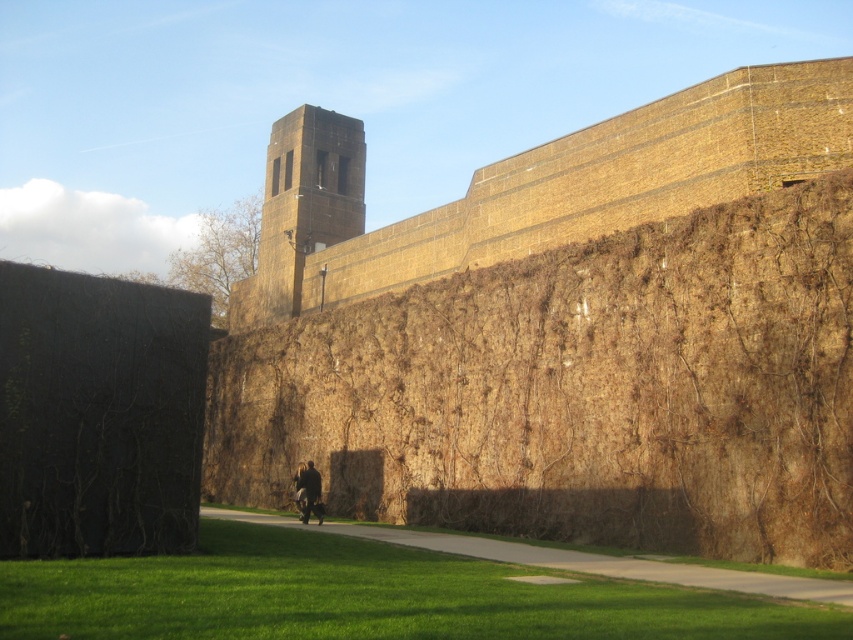
Is green grass at lower center further to the viewer compared to dark brown leather jacket at center?

No, green grass at lower center is closer to the viewer.

Is green grass at lower center thinner than dark brown leather jacket at center?

In fact, green grass at lower center might be wider than dark brown leather jacket at center.

Identify the location of green grass at lower center. (364, 596).

Can you confirm if brown textured hedge at center is positioned to the left of black textured hedge at left?

No, brown textured hedge at center is not to the left of black textured hedge at left.

Can you confirm if brown textured hedge at center is wider than black textured hedge at left?

Yes, brown textured hedge at center is wider than black textured hedge at left.

Who is more distant from viewer, (514, 422) or (22, 292)?

The point (514, 422) is more distant.

Where is `brown textured hedge at center`? The width and height of the screenshot is (853, 640). brown textured hedge at center is located at coordinates (578, 392).

Who is more distant from viewer, (x=144, y=477) or (x=312, y=508)?

Positioned behind is point (x=312, y=508).

At what (x,y) coordinates should I click in order to perform the action: click on black textured hedge at left. Please return your answer as a coordinate pair (x, y). Image resolution: width=853 pixels, height=640 pixels. Looking at the image, I should click on click(x=97, y=413).